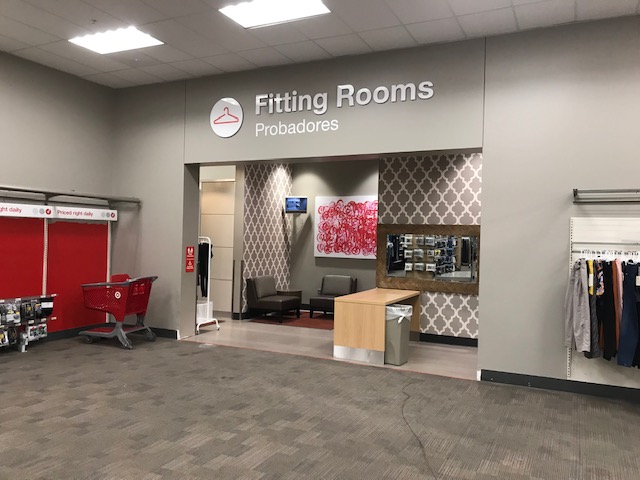
You are a GUI agent. You are given a task and a screenshot of the screen. Output one action in this format:
    pyautogui.click(x=<x>, y=<y>)
    Task: Click on the carpet
    The height and width of the screenshot is (480, 640).
    Given the screenshot: What is the action you would take?
    pyautogui.click(x=116, y=376), pyautogui.click(x=234, y=381), pyautogui.click(x=148, y=465), pyautogui.click(x=333, y=452), pyautogui.click(x=335, y=399), pyautogui.click(x=454, y=390), pyautogui.click(x=500, y=443), pyautogui.click(x=605, y=428)